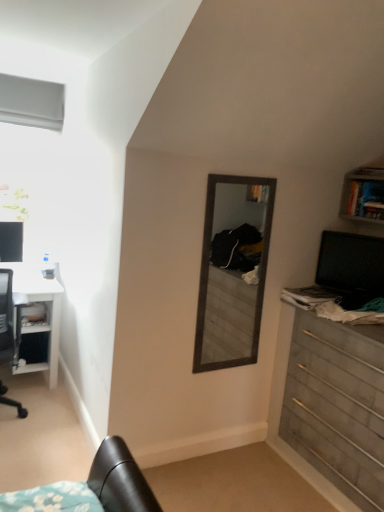
Question: From their relative heights in the image, would you say matte black monitor at left, acting as the first computer monitor starting from the left, is taller or shorter than white matte window at upper left?

Choices:
 (A) short
 (B) tall

Answer: (B)

Question: In the image, is matte black monitor at left, the second computer monitor when ordered from right to left, on the left side or the right side of white matte window at upper left?

Choices:
 (A) left
 (B) right

Answer: (A)

Question: Estimate the real-world distances between objects in this image. Which object is farther from the black glossy computer monitor at right, arranged as the 2th computer monitor when viewed from the left?

Choices:
 (A) matte black monitor at left, the second computer monitor when ordered from right to left
 (B) white glossy desk at left
 (C) brushed metal shelf at lower left
 (D) wooden chest of drawers at right
 (E) white matte window at upper left

Answer: (E)

Question: Which of these objects is positioned closest to the white matte window at upper left?

Choices:
 (A) wooden chest of drawers at right
 (B) brushed metal shelf at lower left
 (C) black glossy computer monitor at right, positioned as the 1th computer monitor in right-to-left order
 (D) white glossy desk at left
 (E) matte black monitor at left, the 1th computer monitor positioned from the back

Answer: (E)